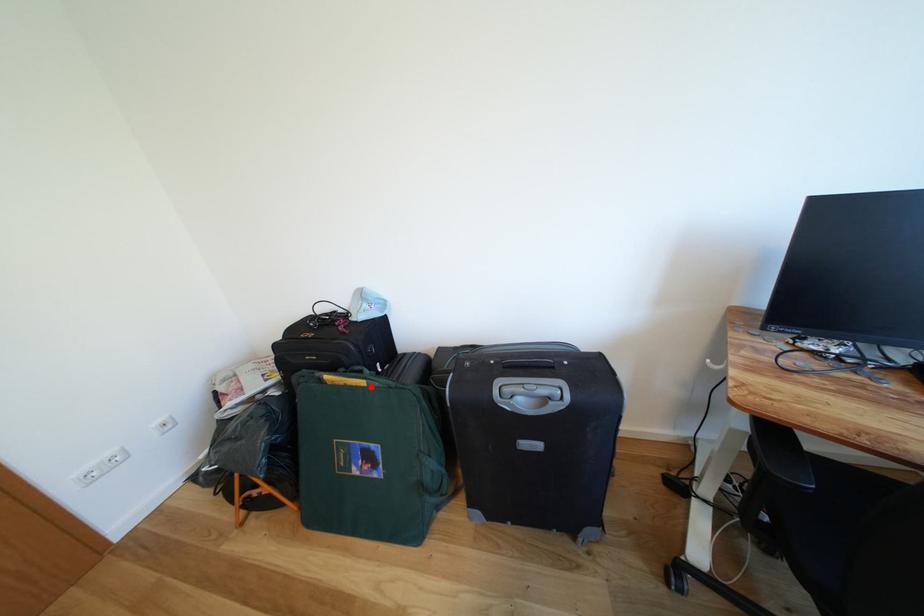
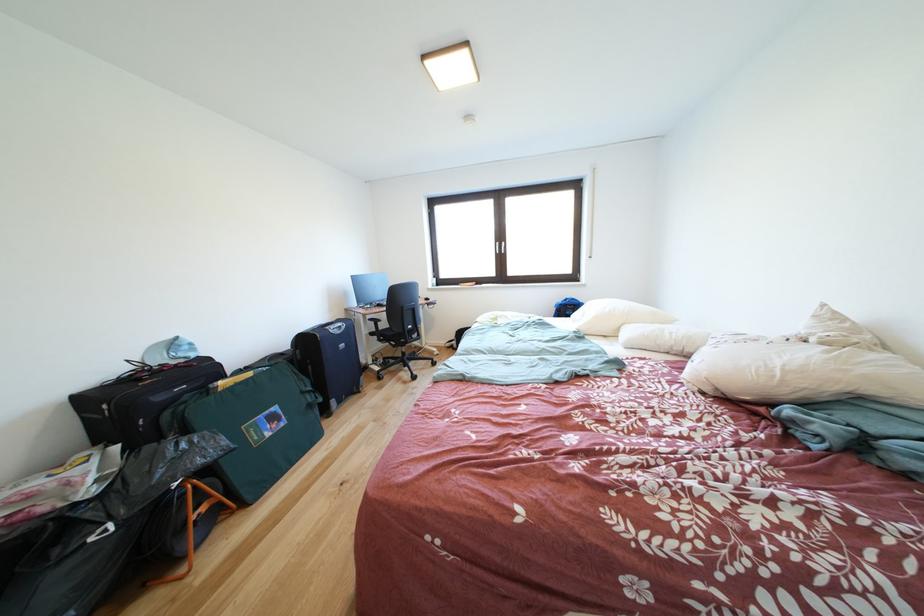
Where in the second image is the point corresponding to the highlighted location from the first image?

(259, 379)